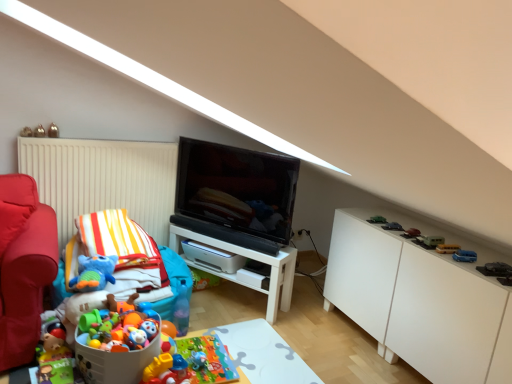
I want to click on free area in between blue plastic toy car at lower right, the eighth toy from the top, and metallic gray car at right, the first toy in the right-to-left sequence, so click(470, 261).